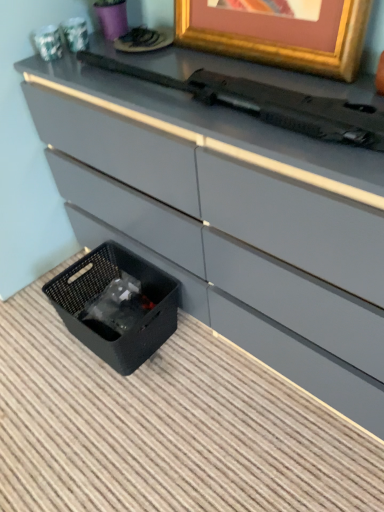
The height and width of the screenshot is (512, 384). What are the coordinates of `black plastic typewriter at upper center` in the screenshot? It's located at (268, 103).

Considering the relative positions of gold metallic picture frame at upper center and black woven basket at lower left in the image provided, is gold metallic picture frame at upper center to the left or to the right of black woven basket at lower left?

From the image, it's evident that gold metallic picture frame at upper center is to the right of black woven basket at lower left.

Between gold metallic picture frame at upper center and black woven basket at lower left, which one has larger width?

With larger width is black woven basket at lower left.

Considering the sizes of objects gold metallic picture frame at upper center and black woven basket at lower left in the image provided, who is shorter, gold metallic picture frame at upper center or black woven basket at lower left?

With less height is gold metallic picture frame at upper center.

What's the angular difference between gold metallic picture frame at upper center and black woven basket at lower left's facing directions?

The facing directions of gold metallic picture frame at upper center and black woven basket at lower left are 1.62 degrees apart.

Is black plastic typewriter at upper center beside gold metallic picture frame at upper center?

No, black plastic typewriter at upper center is not with gold metallic picture frame at upper center.

Which is in front, black plastic typewriter at upper center or gold metallic picture frame at upper center?

black plastic typewriter at upper center is closer to the camera.

Is point (136, 330) farther from camera compared to point (259, 38)?

Yes, it is.

How different are the orientations of black woven basket at lower left and gold metallic picture frame at upper center in degrees?

There is a 1.62-degree angle between the facing directions of black woven basket at lower left and gold metallic picture frame at upper center.

What are the coordinates of `picture frame on the right side of black woven basket at lower left` in the screenshot? It's located at (279, 32).

How far apart are black woven basket at lower left and gold metallic picture frame at upper center?

A distance of 31.66 inches exists between black woven basket at lower left and gold metallic picture frame at upper center.

Consider the image. From a real-world perspective, which is physically below, gold metallic picture frame at upper center or black plastic typewriter at upper center?

From a 3D spatial view, black plastic typewriter at upper center is below.

Is gold metallic picture frame at upper center turned away from black plastic typewriter at upper center?

No, gold metallic picture frame at upper center is not facing the opposite direction of black plastic typewriter at upper center.

Does gold metallic picture frame at upper center appear on the right side of black plastic typewriter at upper center?

Yes, gold metallic picture frame at upper center is to the right of black plastic typewriter at upper center.

Are gold metallic picture frame at upper center and black plastic typewriter at upper center located far from each other?

That's not correct — gold metallic picture frame at upper center is a little close to black plastic typewriter at upper center.

Is black plastic typewriter at upper center in front of black woven basket at lower left?

Yes, black plastic typewriter at upper center is in front of black woven basket at lower left.

Can you confirm if black plastic typewriter at upper center is wider than black woven basket at lower left?

No, black plastic typewriter at upper center is not wider than black woven basket at lower left.

Is black plastic typewriter at upper center looking in the opposite direction of black woven basket at lower left?

No, black woven basket at lower left is not at the back of black plastic typewriter at upper center.

Identify the location of storage box that is under the black plastic typewriter at upper center (from a real-world perspective). This screenshot has height=512, width=384. (116, 305).

Is black woven basket at lower left taller than black plastic typewriter at upper center?

Correct, black woven basket at lower left is much taller as black plastic typewriter at upper center.

Which is closer, (110, 257) or (323, 117)?

Point (110, 257).

Based on their sizes in the image, would you say black woven basket at lower left is bigger or smaller than black plastic typewriter at upper center?

Considering their sizes, black woven basket at lower left takes up more space than black plastic typewriter at upper center.

Considering the sizes of black woven basket at lower left and black plastic typewriter at upper center in the image, is black woven basket at lower left wider or thinner than black plastic typewriter at upper center?

In the image, black woven basket at lower left appears to be wider than black plastic typewriter at upper center.

Where is `picture frame that appears above the black woven basket at lower left (from a real-world perspective)`? picture frame that appears above the black woven basket at lower left (from a real-world perspective) is located at coordinates (279, 32).

I want to click on typewriter directly beneath the gold metallic picture frame at upper center (from a real-world perspective), so click(x=268, y=103).

When comparing their distances from black plastic typewriter at upper center, does gold metallic picture frame at upper center or black woven basket at lower left seem further?

black woven basket at lower left lies further to black plastic typewriter at upper center than the other object.

Estimate the real-world distances between objects in this image. Which object is closer to black plastic typewriter at upper center, black woven basket at lower left or gold metallic picture frame at upper center?

Among the two, gold metallic picture frame at upper center is located nearer to black plastic typewriter at upper center.

Considering their positions, is black plastic typewriter at upper center positioned further to gold metallic picture frame at upper center than black woven basket at lower left?

The object further to gold metallic picture frame at upper center is black woven basket at lower left.

Considering their positions, is gold metallic picture frame at upper center positioned closer to black woven basket at lower left than black plastic typewriter at upper center?

Among the two, black plastic typewriter at upper center is located nearer to black woven basket at lower left.

When comparing their distances from gold metallic picture frame at upper center, does black woven basket at lower left or black plastic typewriter at upper center seem further?

black woven basket at lower left is positioned further to the anchor gold metallic picture frame at upper center.

Which object lies further to the anchor point black woven basket at lower left, black plastic typewriter at upper center or gold metallic picture frame at upper center?

gold metallic picture frame at upper center is positioned further to the anchor black woven basket at lower left.

At what (x,y) coordinates should I click in order to perform the action: click on typewriter between gold metallic picture frame at upper center and black woven basket at lower left in the up-down direction. Please return your answer as a coordinate pair (x, y). This screenshot has height=512, width=384. Looking at the image, I should click on (268, 103).